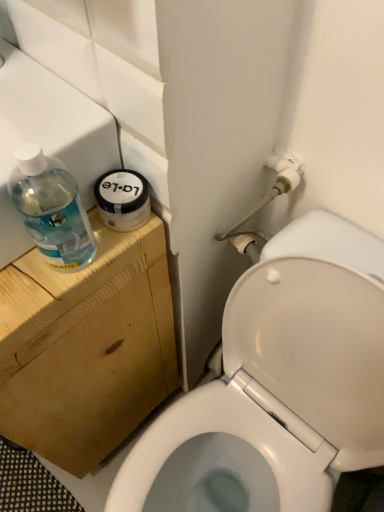
Image resolution: width=384 pixels, height=512 pixels. What do you see at coordinates (48, 136) in the screenshot?
I see `transparent plastic sink at upper left, the 2th sink in the back-to-front sequence` at bounding box center [48, 136].

Measure the distance between point (27, 206) and camera.

They are 18.19 inches apart.

Where is `transparent plastic bottle at left`? This screenshot has width=384, height=512. transparent plastic bottle at left is located at coordinates (51, 209).

Locate an element on the screen. The height and width of the screenshot is (512, 384). white glossy toilet at lower right is located at coordinates (279, 383).

From the image's perspective, who appears lower, transparent plastic sink at upper left, the 2th sink in the back-to-front sequence, or transparent plastic bottle at left?

transparent plastic bottle at left appears lower in the image.

Does transparent plastic sink at upper left, positioned as the first sink in front-to-back order, have a smaller size compared to transparent plastic bottle at left?

No, transparent plastic sink at upper left, positioned as the first sink in front-to-back order, is not smaller than transparent plastic bottle at left.

Between transparent plastic sink at upper left, the 2th sink in the back-to-front sequence, and transparent plastic bottle at left, which one is positioned behind?

Positioned behind is transparent plastic sink at upper left, the 2th sink in the back-to-front sequence.

Can you confirm if transparent plastic sink at upper left, positioned as the first sink in front-to-back order, is wider than transparent plastic bottle at left?

Indeed, transparent plastic sink at upper left, positioned as the first sink in front-to-back order, has a greater width compared to transparent plastic bottle at left.

Is transparent plastic sink at upper left, the 2th sink in the back-to-front sequence, oriented away from transparent plastic sink at upper left, the first sink viewed from the back?

No, transparent plastic sink at upper left, the 2th sink in the back-to-front sequence, is not facing the opposite direction of transparent plastic sink at upper left, the first sink viewed from the back.

Would you consider transparent plastic sink at upper left, positioned as the first sink in front-to-back order, to be distant from transparent plastic sink at upper left, the first sink viewed from the back?

No, transparent plastic sink at upper left, positioned as the first sink in front-to-back order, is not far from transparent plastic sink at upper left, the first sink viewed from the back.

From the image's perspective, does transparent plastic sink at upper left, the 2th sink in the back-to-front sequence, appear higher than transparent plastic sink at upper left, the first sink viewed from the back?

Yes.

Which is behind, point (137, 261) or point (77, 246)?

The point (137, 261) is farther from the camera.

From a real-world perspective, which object rests below the other?

transparent plastic sink at upper left, the first sink viewed from the back, is physically lower.

In the scene shown: Can transparent plastic bottle at left be found inside transparent plastic sink at upper left, the first sink viewed from the back?

No, transparent plastic sink at upper left, the first sink viewed from the back, does not contain transparent plastic bottle at left.

From the picture: Does transparent plastic bottle at left turn towards transparent plastic sink at upper left, which appears as the 2th sink when viewed from the front?

No.

Considering the sizes of objects transparent plastic bottle at left and transparent plastic sink at upper left, which appears as the 2th sink when viewed from the front, in the image provided, who is taller, transparent plastic bottle at left or transparent plastic sink at upper left, which appears as the 2th sink when viewed from the front,?

transparent plastic sink at upper left, which appears as the 2th sink when viewed from the front, is taller.

From a real-world perspective, which is physically above, transparent plastic bottle at left or transparent plastic sink at upper left, which appears as the 2th sink when viewed from the front?

In real-world perspective, transparent plastic bottle at left is above.

Between transparent plastic bottle at left and transparent plastic sink at upper left, which appears as the 2th sink when viewed from the front, which one is positioned behind?

transparent plastic sink at upper left, which appears as the 2th sink when viewed from the front, is more distant.

Identify the location of the 1st sink behind the white glossy toilet at lower right. The width and height of the screenshot is (384, 512). (48, 136).

Can you confirm if white glossy toilet at lower right is taller than transparent plastic sink at upper left, positioned as the first sink in front-to-back order?

Yes.

Could you tell me if white glossy toilet at lower right is facing transparent plastic sink at upper left, positioned as the first sink in front-to-back order?

No, white glossy toilet at lower right is not aimed at transparent plastic sink at upper left, positioned as the first sink in front-to-back order.

From a real-world perspective, does white glossy toilet at lower right sit lower than transparent plastic sink at upper left, positioned as the first sink in front-to-back order?

Correct, in the physical world, white glossy toilet at lower right is lower than transparent plastic sink at upper left, positioned as the first sink in front-to-back order.

From a real-world perspective, is transparent plastic sink at upper left, which appears as the 2th sink when viewed from the front, above or below transparent plastic sink at upper left, positioned as the first sink in front-to-back order?

Clearly, from a real-world perspective, transparent plastic sink at upper left, which appears as the 2th sink when viewed from the front, is below transparent plastic sink at upper left, positioned as the first sink in front-to-back order.

You are a GUI agent. You are given a task and a screenshot of the screen. Output one action in this format:
    pyautogui.click(x=<x>, y=<y>)
    Task: Click on the sink directly beneath the transparent plastic sink at upper left, positioned as the first sink in front-to-back order (from a real-world perspective)
    The height and width of the screenshot is (512, 384).
    Given the screenshot: What is the action you would take?
    pyautogui.click(x=76, y=293)

Between point (25, 419) and point (9, 200), which one is positioned behind?

The point (25, 419) is farther from the camera.

How many degrees apart are the facing directions of transparent plastic sink at upper left, which appears as the 2th sink when viewed from the front, and transparent plastic sink at upper left, the 2th sink in the back-to-front sequence?

0.651 degrees separate the facing orientations of transparent plastic sink at upper left, which appears as the 2th sink when viewed from the front, and transparent plastic sink at upper left, the 2th sink in the back-to-front sequence.

Is transparent plastic sink at upper left, the 2th sink in the back-to-front sequence, bigger than white glossy toilet at lower right?

Incorrect, transparent plastic sink at upper left, the 2th sink in the back-to-front sequence, is not larger than white glossy toilet at lower right.

Can you see transparent plastic sink at upper left, the 2th sink in the back-to-front sequence, touching white glossy toilet at lower right?

No, transparent plastic sink at upper left, the 2th sink in the back-to-front sequence, is not making contact with white glossy toilet at lower right.

Which object is positioned more to the left, transparent plastic sink at upper left, the 2th sink in the back-to-front sequence, or white glossy toilet at lower right?

transparent plastic sink at upper left, the 2th sink in the back-to-front sequence.

From a real-world perspective, starting from the transparent plastic bottle at left, which sink is the 1st one below it? Please provide its 2D coordinates.

[(48, 136)]

Identify the location of sink on the right of the transparent plastic sink at upper left, the first sink viewed from the back. Image resolution: width=384 pixels, height=512 pixels. (48, 136).

From the picture: Estimate the real-world distances between objects in this image. Which object is further from transparent plastic sink at upper left, the first sink viewed from the back, transparent plastic sink at upper left, the 2th sink in the back-to-front sequence, or white glossy toilet at lower right?

white glossy toilet at lower right.

Based on their spatial positions, is white glossy toilet at lower right or transparent plastic sink at upper left, positioned as the first sink in front-to-back order, closer to transparent plastic bottle at left?

transparent plastic sink at upper left, positioned as the first sink in front-to-back order, is closer to transparent plastic bottle at left.

Based on their spatial positions, is transparent plastic bottle at left or transparent plastic sink at upper left, the first sink viewed from the back, closer to white glossy toilet at lower right?

The object closer to white glossy toilet at lower right is transparent plastic sink at upper left, the first sink viewed from the back.

From the image, which object appears to be nearer to white glossy toilet at lower right, transparent plastic bottle at left or transparent plastic sink at upper left, the 2th sink in the back-to-front sequence?

transparent plastic bottle at left is positioned closer to the anchor white glossy toilet at lower right.

In the scene shown: Which object lies nearer to the anchor point transparent plastic sink at upper left, the 2th sink in the back-to-front sequence, white glossy toilet at lower right or transparent plastic bottle at left?

The object closer to transparent plastic sink at upper left, the 2th sink in the back-to-front sequence, is transparent plastic bottle at left.

Considering their positions, is white glossy toilet at lower right positioned closer to transparent plastic sink at upper left, positioned as the first sink in front-to-back order, than transparent plastic sink at upper left, which appears as the 2th sink when viewed from the front?

The object closer to transparent plastic sink at upper left, positioned as the first sink in front-to-back order, is transparent plastic sink at upper left, which appears as the 2th sink when viewed from the front.

Considering their positions, is transparent plastic bottle at left positioned closer to transparent plastic sink at upper left, which appears as the 2th sink when viewed from the front, than transparent plastic sink at upper left, positioned as the first sink in front-to-back order?

transparent plastic sink at upper left, positioned as the first sink in front-to-back order, is positioned closer to the anchor transparent plastic sink at upper left, which appears as the 2th sink when viewed from the front.

From the image, which object appears to be farther from transparent plastic sink at upper left, positioned as the first sink in front-to-back order, transparent plastic sink at upper left, the first sink viewed from the back, or transparent plastic bottle at left?

transparent plastic sink at upper left, the first sink viewed from the back, is further to transparent plastic sink at upper left, positioned as the first sink in front-to-back order.

You are a GUI agent. You are given a task and a screenshot of the screen. Output one action in this format:
    pyautogui.click(x=<x>, y=<y>)
    Task: Click on the bottle that lies between transparent plastic sink at upper left, the 2th sink in the back-to-front sequence, and transparent plastic sink at upper left, which appears as the 2th sink when viewed from the front, from top to bottom
    The width and height of the screenshot is (384, 512).
    Given the screenshot: What is the action you would take?
    pyautogui.click(x=51, y=209)

This screenshot has width=384, height=512. Identify the location of bottle situated between transparent plastic sink at upper left, the first sink viewed from the back, and white glossy toilet at lower right from left to right. (51, 209).

Locate an element on the screen. This screenshot has height=512, width=384. sink between transparent plastic sink at upper left, positioned as the first sink in front-to-back order, and white glossy toilet at lower right, in the vertical direction is located at coordinates (76, 293).

Where is `bottle that lies between transparent plastic sink at upper left, the 2th sink in the back-to-front sequence, and white glossy toilet at lower right from top to bottom`? Image resolution: width=384 pixels, height=512 pixels. bottle that lies between transparent plastic sink at upper left, the 2th sink in the back-to-front sequence, and white glossy toilet at lower right from top to bottom is located at coordinates (51, 209).